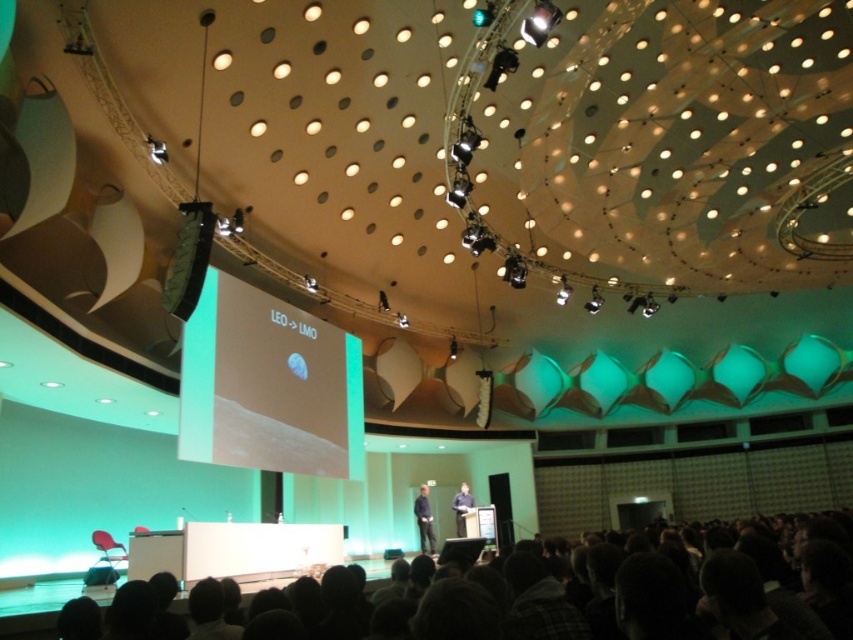
You are an attendee at the presentation and want to take a photo of the slide on the projection screen. To avoid glare from the ceiling lights, you decide to position yourself so that the dark gray hair at lower center and the dark blue fabric at center are not blocking your view. Which object should you move around to get a clear shot of the screen?

The dark gray hair at lower center is located above the dark blue fabric at center. To avoid obstruction, you should move around the dark blue fabric at center since the dark gray hair is above it and less likely to block the view directly.

You are an attendee in the auditorium and want to locate the point at coordinates (268, 385) on the screen. Where exactly on the screen is this point located?

The point at coordinates (268, 385) is located on the green matte projection screen at center.

You are an event organizer who needs to set up a new speaker podium between the green matte projection screen at center and the black fabric at center. The podium requires 2 meters of space in front of it. Is there enough space between these two items to place the podium?

The distance between the green matte projection screen at center and the black fabric at center is 7.64 meters. Subtracting the required 2 meters for the podium, there is still 5.64 meters remaining, which means there is sufficient space to place the podium between them.